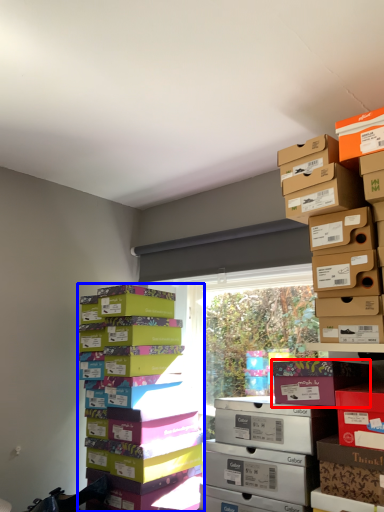
Question: Which point is closer to the camera, cardboard box (highlighted by a red box) or package (highlighted by a blue box)?

Choices:
 (A) cardboard box
 (B) package

Answer: (A)